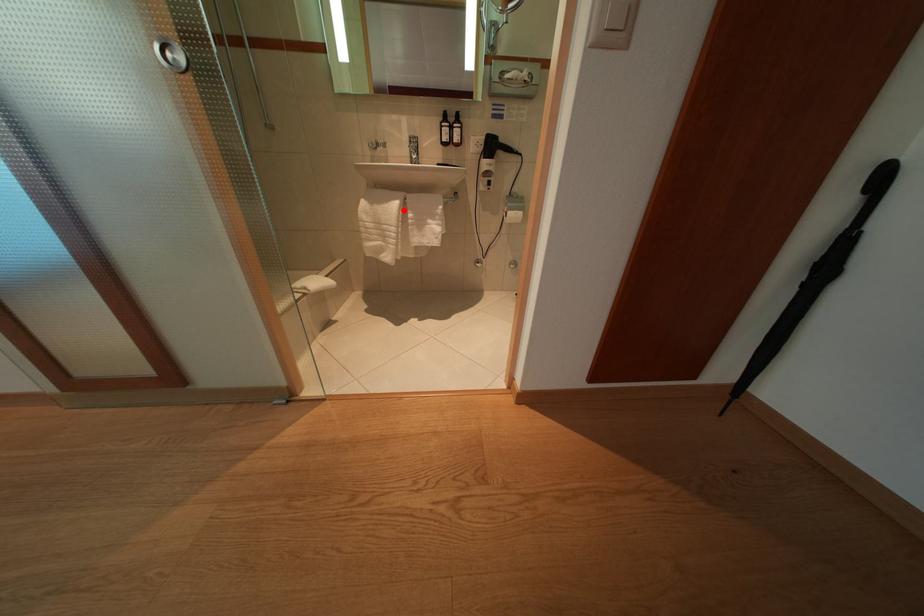
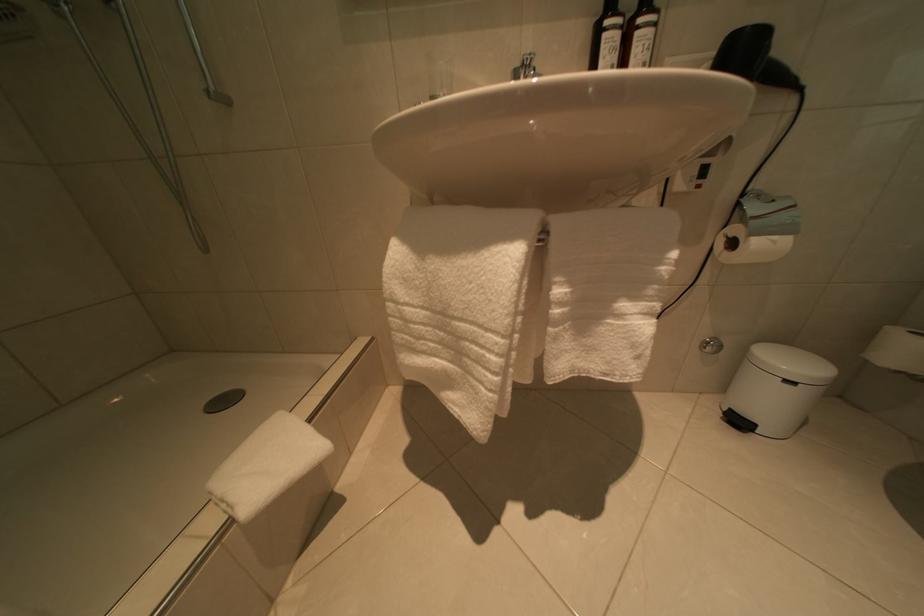
Question: A red point is marked in image1. In image2, is the corresponding 3D point closer to the camera or farther? Reply with the corresponding letter.

Choices:
 (A) The corresponding 3D point is closer.
 (B) The corresponding 3D point is farther.

Answer: (B)